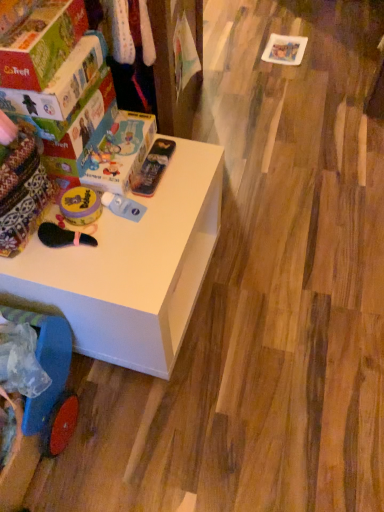
The image size is (384, 512). Identify the location of vacant area located to the right-hand side of yellow matte container at left, arranged as the third toy when viewed from the right. (156, 215).